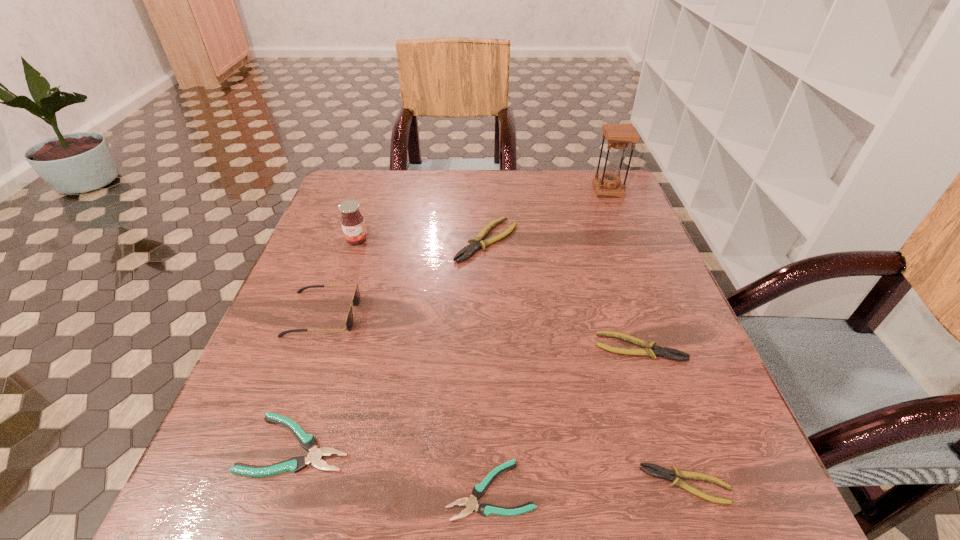
Select which yellow pliers is the second closest to the leftmost pliers. Please provide its 2D coordinates. Your answer should be formatted as a tuple, i.e. [(x, y)], where the tuple contains the x and y coordinates of a point satisfying the conditions above.

[(649, 349)]

Identify which yellow pliers is located as the third nearest to the shortest object. Please provide its 2D coordinates. Your answer should be formatted as a tuple, i.e. [(x, y)], where the tuple contains the x and y coordinates of a point satisfying the conditions above.

[(477, 243)]

You are a GUI agent. You are given a task and a screenshot of the screen. Output one action in this format:
    pyautogui.click(x=<x>, y=<y>)
    Task: Click on the free spot that satisfies the following two spatial constraints: 1. on the front-facing side of the third tallest object; 2. on the right side of the leftmost pliers
    The width and height of the screenshot is (960, 540).
    Given the screenshot: What is the action you would take?
    pyautogui.click(x=276, y=444)

At what (x,y) coordinates should I click in order to perform the action: click on free space that satisfies the following two spatial constraints: 1. on the front-facing side of the sixth shortest object; 2. on the left side of the smallest yellow pliers. Please return your answer as a coordinate pair (x, y). The width and height of the screenshot is (960, 540). Looking at the image, I should click on (261, 484).

This screenshot has width=960, height=540. In order to click on vacant space that satisfies the following two spatial constraints: 1. on the back side of the shortest pliers; 2. on the right side of the smallest yellow pliers in this screenshot , I will do `click(491, 484)`.

I want to click on free space that satisfies the following two spatial constraints: 1. on the label side of the shortest pliers; 2. on the right side of the second tallest object, so click(271, 490).

Identify the location of vacant space that satisfies the following two spatial constraints: 1. on the label side of the second tallest object; 2. on the left side of the bigger teal pliers. (287, 444).

Image resolution: width=960 pixels, height=540 pixels. I want to click on vacant point that satisfies the following two spatial constraints: 1. on the front-facing side of the nearest yellow pliers; 2. on the left side of the sixth shortest object, so click(x=261, y=484).